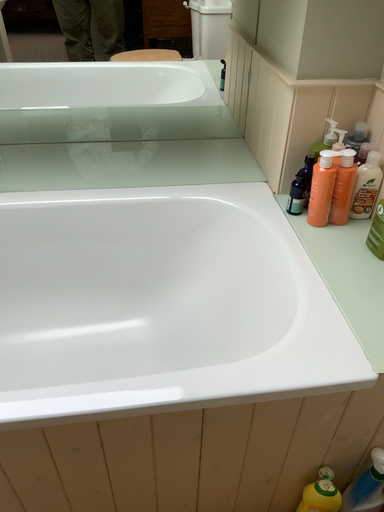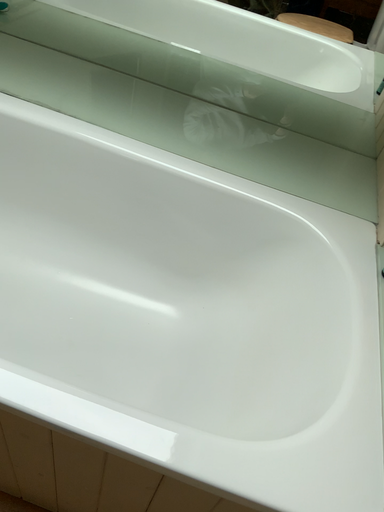
Question: Which way did the camera rotate in the video?

Choices:
 (A) rotated left
 (B) rotated right

Answer: (A)